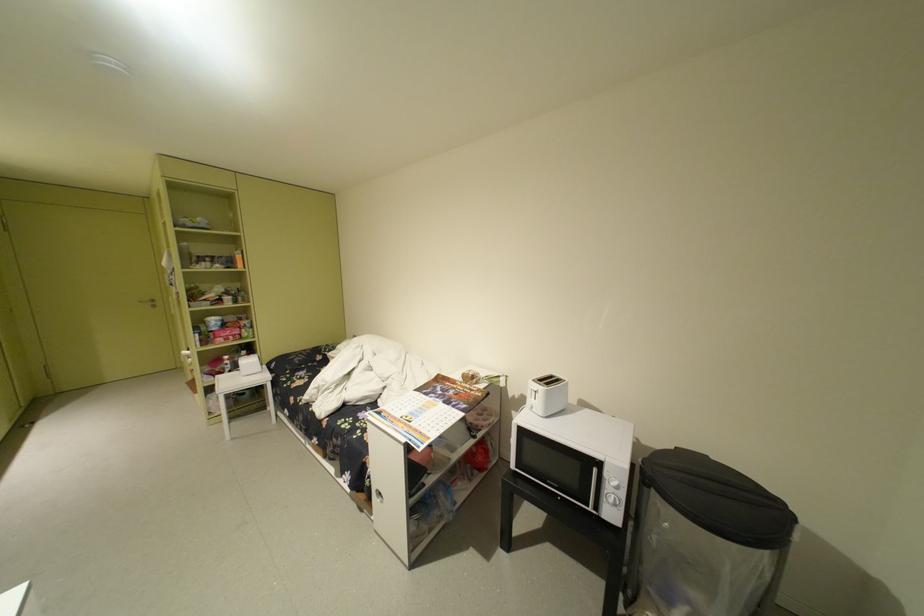
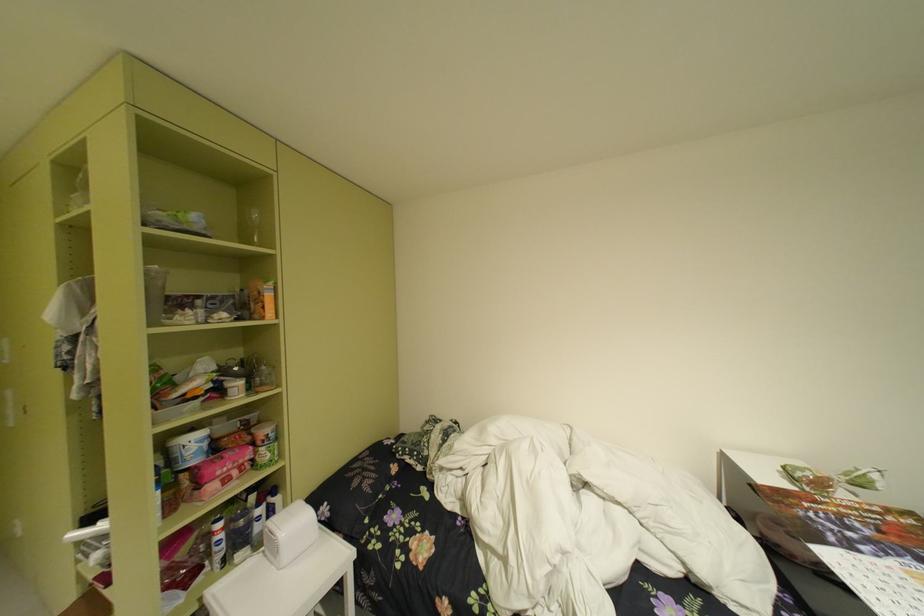
In a continuous first-person perspective shot, in which direction is the camera moving?

The cameraman walked toward left, forward.